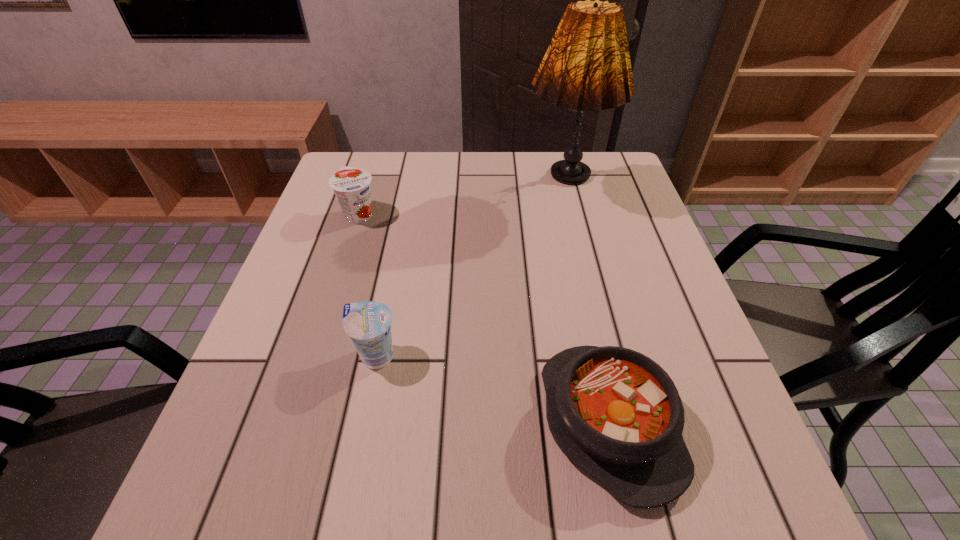
This screenshot has height=540, width=960. I want to click on free spot between the casserole and the lampshade, so click(x=587, y=306).

This screenshot has height=540, width=960. In order to click on the closest object to the casserole in this screenshot , I will do `click(368, 323)`.

The image size is (960, 540). I want to click on the closest object relative to the farther yogurt, so click(x=368, y=323).

The height and width of the screenshot is (540, 960). Identify the location of free spot that satisfies the following two spatial constraints: 1. on the front side of the casserole; 2. on the right side of the leftmost object. (293, 422).